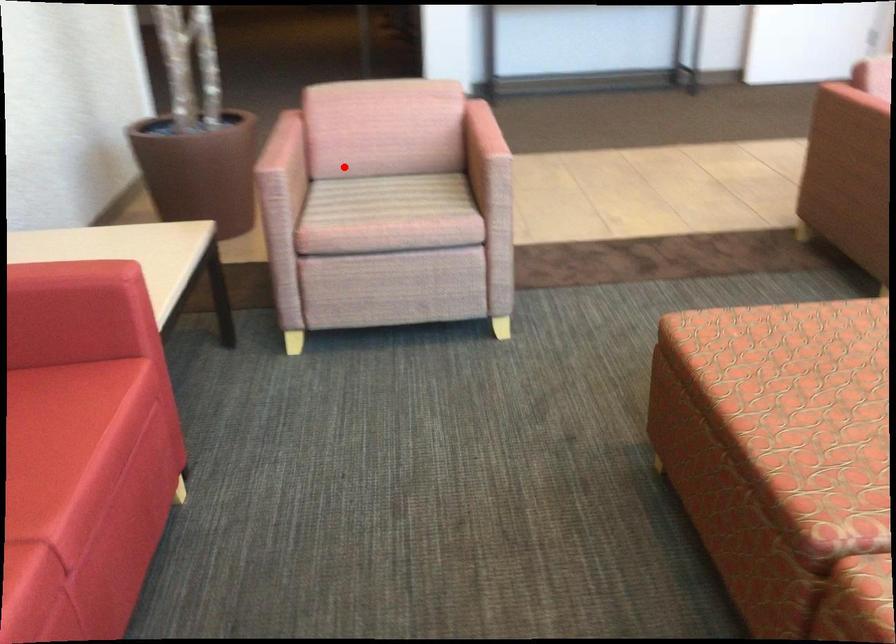
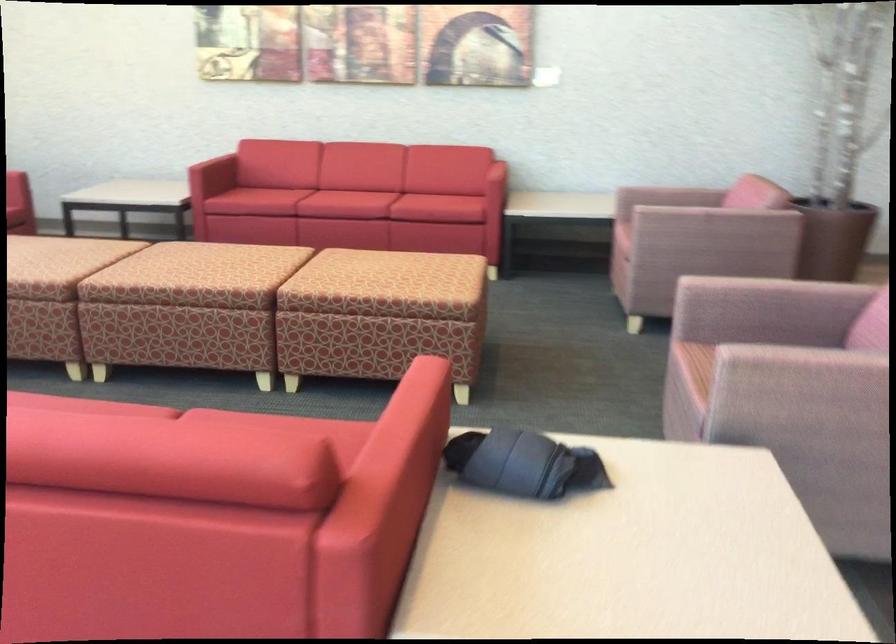
Question: I am providing you with two images of the same scene from different viewpoints. Given a red point in image1, look at the same physical point in image2. Is it:

Choices:
 (A) Closer to the viewpoint
 (B) Farther from the viewpoint

Answer: (B)